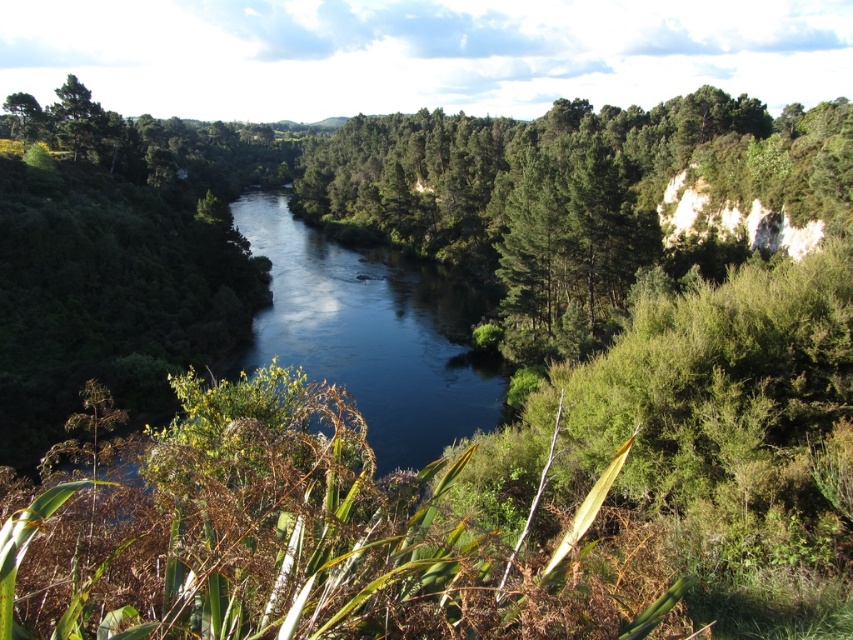
Is green leafy tree at center below dark blue water at center?

No, green leafy tree at center is not below dark blue water at center.

Which of these two, green leafy tree at center or dark blue water at center, stands shorter?

dark blue water at center

Is point (502, 132) behind point (378, 314)?

Yes, point (502, 132) is behind point (378, 314).

Locate an element on the screen. green leafy tree at center is located at coordinates (584, 196).

Does dark blue water at center have a smaller size compared to green leafy tree at upper left?

Incorrect, dark blue water at center is not smaller in size than green leafy tree at upper left.

Is dark blue water at center positioned in front of green leafy tree at upper left?

Yes, it is in front of green leafy tree at upper left.

The image size is (853, 640). Describe the element at coordinates (369, 333) in the screenshot. I see `dark blue water at center` at that location.

Where is `dark blue water at center`? dark blue water at center is located at coordinates (369, 333).

Which is behind, point (686, 132) or point (24, 113)?

The point (24, 113) is more distant.

Does green leafy tree at center have a larger size compared to green leafy tree at upper left?

Indeed, green leafy tree at center has a larger size compared to green leafy tree at upper left.

Which is behind, point (573, 317) or point (25, 129)?

Point (25, 129)

You are a GUI agent. You are given a task and a screenshot of the screen. Output one action in this format:
    pyautogui.click(x=<x>, y=<y>)
    Task: Click on the green leafy tree at center
    This screenshot has height=640, width=853.
    Given the screenshot: What is the action you would take?
    pyautogui.click(x=584, y=196)